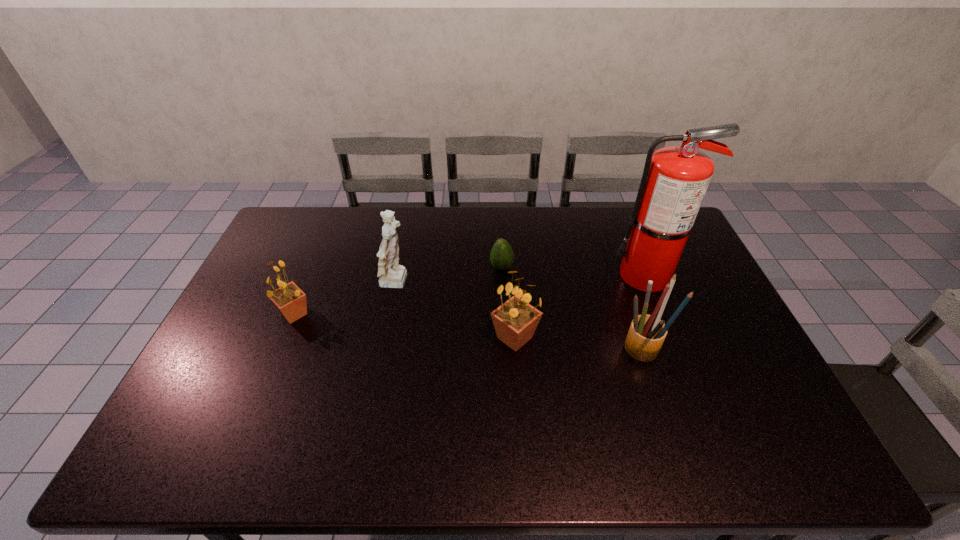
Locate an element on the screen. The width and height of the screenshot is (960, 540). vacant space at the near edge of the desktop is located at coordinates (389, 408).

You are a GUI agent. You are given a task and a screenshot of the screen. Output one action in this format:
    pyautogui.click(x=<x>, y=<y>)
    Task: Click on the vacant space at the left edge
    This screenshot has height=540, width=960.
    Given the screenshot: What is the action you would take?
    pyautogui.click(x=273, y=278)

The height and width of the screenshot is (540, 960). In the image, there is a desktop. Find the location of `free space at the right edge`. free space at the right edge is located at coordinates (698, 335).

In order to click on blank region between the figurine and the fire extinguisher in this screenshot , I will do `click(521, 280)`.

Locate an element on the screen. unoccupied area between the second object from left to right and the shortest object is located at coordinates (449, 275).

I want to click on vacant space in between the tallest object and the figurine, so (x=521, y=280).

You are a GUI agent. You are given a task and a screenshot of the screen. Output one action in this format:
    pyautogui.click(x=<x>, y=<y>)
    Task: Click on the free area in between the tallest object and the taller sunflower
    This screenshot has width=960, height=540.
    Given the screenshot: What is the action you would take?
    (x=580, y=307)

At what (x,y) coordinates should I click in order to perform the action: click on free space between the leftmost object and the tallest object. Please return your answer as a coordinate pair (x, y). The height and width of the screenshot is (540, 960). Looking at the image, I should click on (470, 295).

Locate an element on the screen. Image resolution: width=960 pixels, height=540 pixels. empty space between the left sunflower and the avocado is located at coordinates (397, 291).

Locate an element on the screen. the fourth closest object to the second object from left to right is located at coordinates (646, 334).